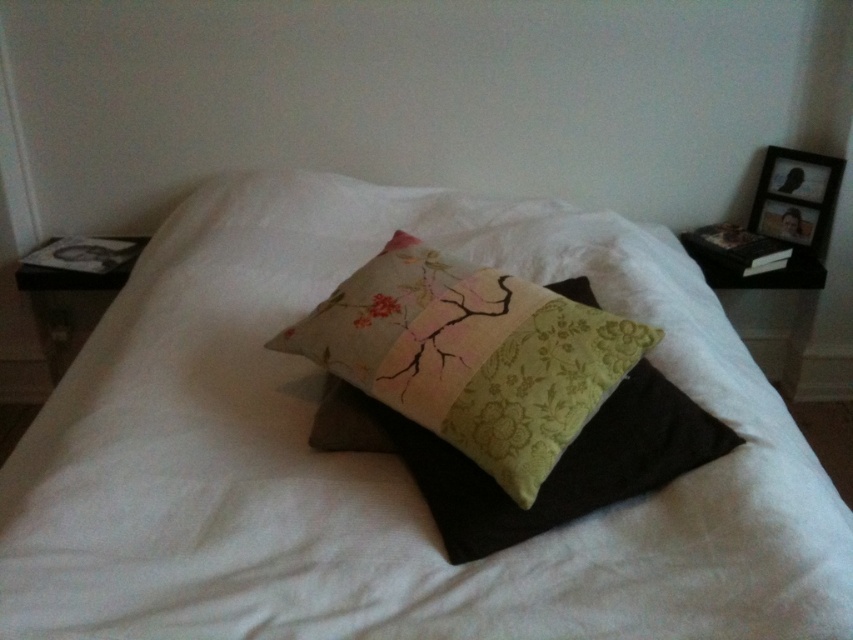
Is textured cotton bed at center above patchwork fabric cushion at center?

Yes, textured cotton bed at center is above patchwork fabric cushion at center.

Who is shorter, textured cotton bed at center or patchwork fabric cushion at center?

patchwork fabric cushion at center is shorter.

You are a GUI agent. You are given a task and a screenshot of the screen. Output one action in this format:
    pyautogui.click(x=<x>, y=<y>)
    Task: Click on the textured cotton bed at center
    The height and width of the screenshot is (640, 853).
    Given the screenshot: What is the action you would take?
    pyautogui.click(x=386, y=456)